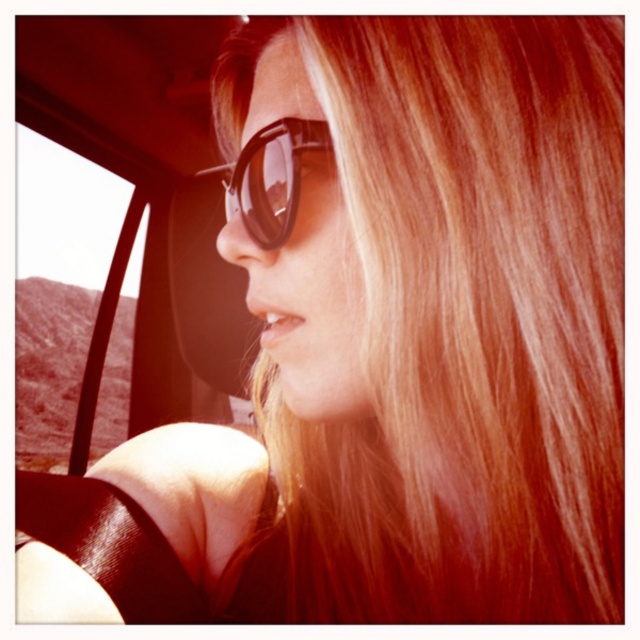
You are a passenger in the car and want to see the desert landscape outside through either the transparent glass car window at left or the black plastic goggles at center. Which object allows you to see the desert landscape more clearly?

The transparent glass car window at left allows you to see the desert landscape more clearly because it is made of transparent material, unlike the black plastic goggles at center which may obstruct the view.

You are a delivery robot with a height of 1.8 meters. You need to pass through the space between the transparent glass car window at left and the black plastic goggles at center. Can you fit through this space vertically?

The distance between the transparent glass car window at left and the black plastic goggles at center is 2.16 meters. Since your height is 1.8 meters, which is less than the available space, you can fit through vertically.